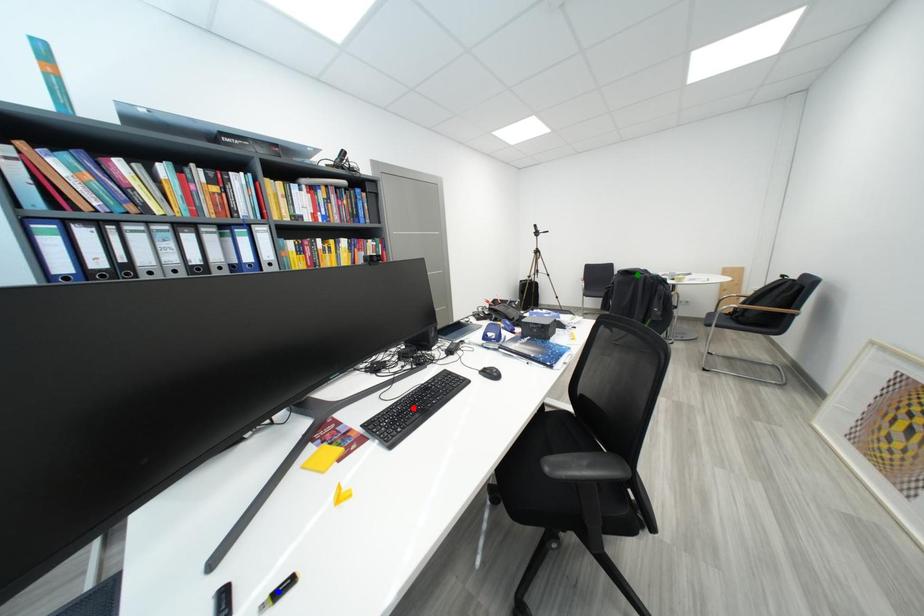
Order these from nearest to farthest:
blue point, red point, green point

blue point → red point → green point